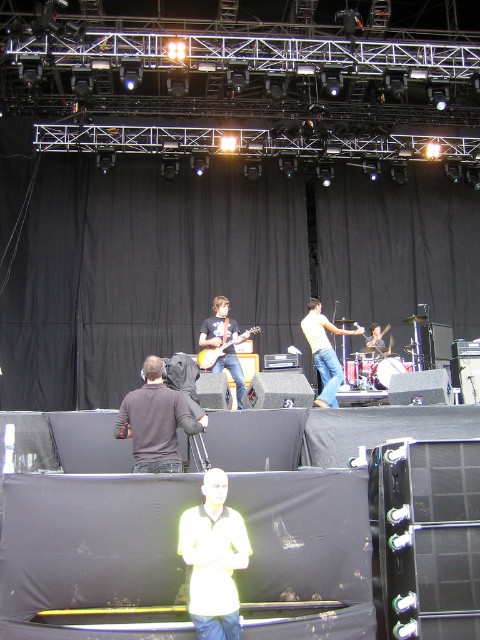
Question: Which of the following is the closest to the observer?

Choices:
 (A) light yellow shirt at center
 (B) black matte guitar at center
 (C) white matte shirt at center
 (D) glossy wood guitar at center

Answer: (C)

Question: Which object is farther from the camera taking this photo?

Choices:
 (A) light yellow shirt at center
 (B) white matte shirt at center

Answer: (A)

Question: Which object is the farthest from the black matte guitar at center?

Choices:
 (A) light yellow shirt at center
 (B) dark gray fabric at center

Answer: (B)

Question: Does white matte shirt at center appear on the left side of dark gray fabric at center?

Choices:
 (A) yes
 (B) no

Answer: (B)

Question: Is the position of dark gray fabric at center more distant than that of light yellow shirt at center?

Choices:
 (A) no
 (B) yes

Answer: (A)

Question: Is dark gray fabric at center positioned before glossy wood guitar at center?

Choices:
 (A) yes
 (B) no

Answer: (A)